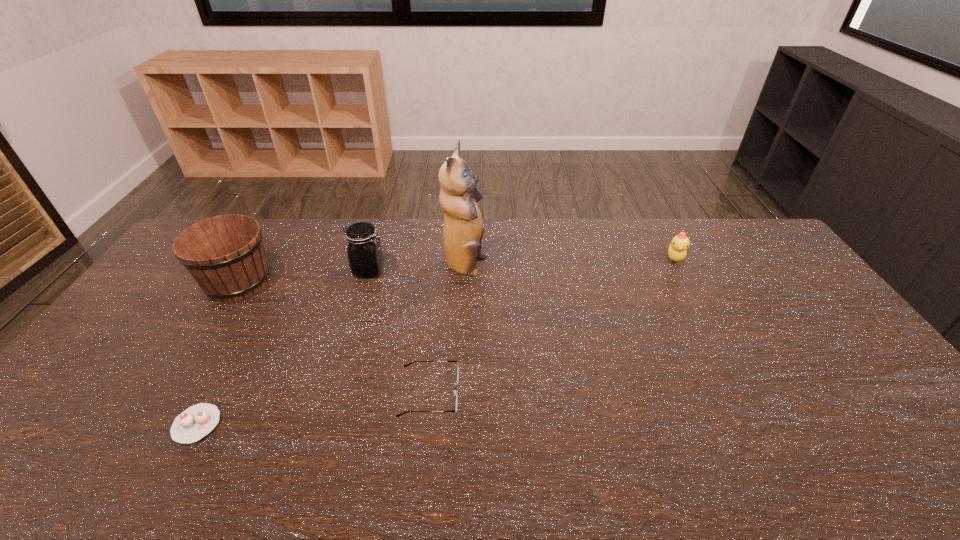
At what (x,y) coordinates should I click in order to perform the action: click on the tallest object. Please return your answer as a coordinate pair (x, y). The width and height of the screenshot is (960, 540). Looking at the image, I should click on (463, 231).

Where is `wine bucket`? wine bucket is located at coordinates (225, 254).

The image size is (960, 540). What are the coordinates of `jar` in the screenshot? It's located at (364, 251).

This screenshot has height=540, width=960. What are the coordinates of `duckling` in the screenshot? It's located at (677, 250).

Where is `the third shortest object`? The width and height of the screenshot is (960, 540). the third shortest object is located at coordinates (677, 250).

Where is `spectacles`? spectacles is located at coordinates (457, 375).

The image size is (960, 540). What are the coordinates of `the shortest object` in the screenshot? It's located at (194, 423).

Where is `vacant point located on the face of the cat`? vacant point located on the face of the cat is located at coordinates (542, 267).

You are a GUI agent. You are given a task and a screenshot of the screen. Output one action in this format:
    pyautogui.click(x=<x>, y=<y>)
    Task: Click on the free region located 0.270m on the right of the wine bucket
    Image resolution: width=960 pixels, height=540 pixels.
    Given the screenshot: What is the action you would take?
    click(x=356, y=282)

At what (x,y) coordinates should I click in order to perform the action: click on vacant space situated on the lid of the jar. Please return your answer as a coordinate pair (x, y). The image size is (960, 540). Looking at the image, I should click on (460, 271).